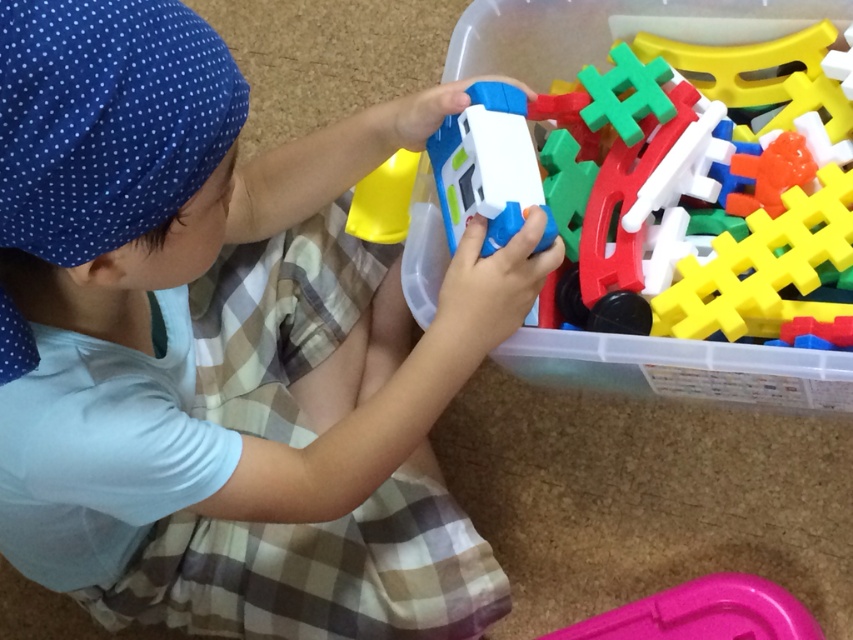
Question: Which object appears closest to the camera in this image?

Choices:
 (A) matte plastic toy car at center
 (B) pink plastic tray at lower right

Answer: (A)

Question: Does blue plastic toy car at center have a smaller size compared to pink plastic tray at lower right?

Choices:
 (A) no
 (B) yes

Answer: (A)

Question: Which point is farther to the camera?

Choices:
 (A) matte plastic toy car at center
 (B) blue plastic toy car at center

Answer: (B)

Question: Is matte plastic toy car at center in front of blue plastic toy car at center?

Choices:
 (A) yes
 (B) no

Answer: (A)

Question: Is matte plastic toy car at center wider than pink plastic tray at lower right?

Choices:
 (A) yes
 (B) no

Answer: (A)

Question: Among these objects, which one is farthest from the camera?

Choices:
 (A) pink plastic tray at lower right
 (B) matte plastic toy car at center

Answer: (A)